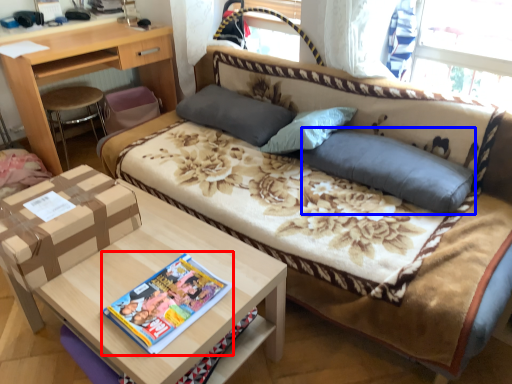
Question: Which of the following is the closest to the observer, magazine (highlighted by a red box) or pillow (highlighted by a blue box)?

Choices:
 (A) magazine
 (B) pillow

Answer: (A)